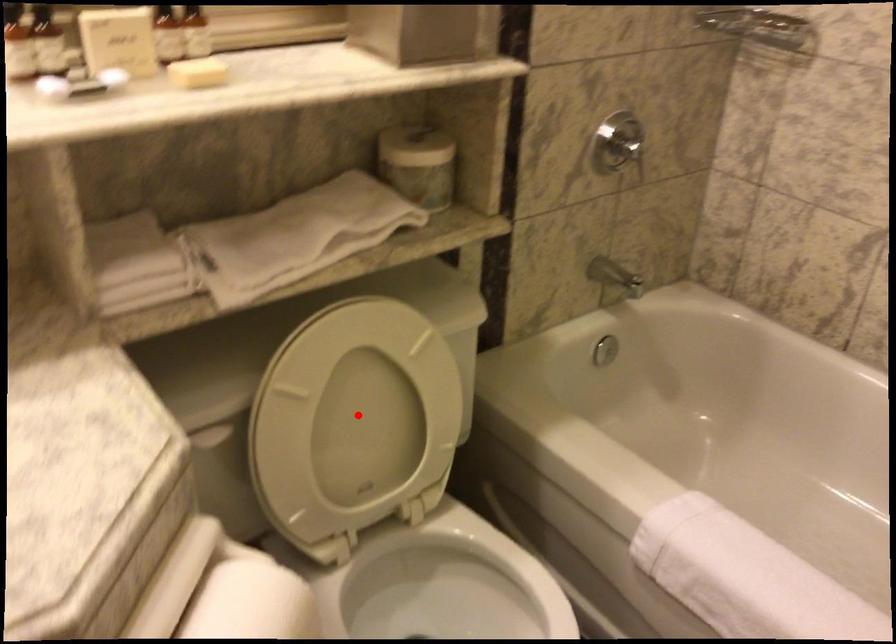
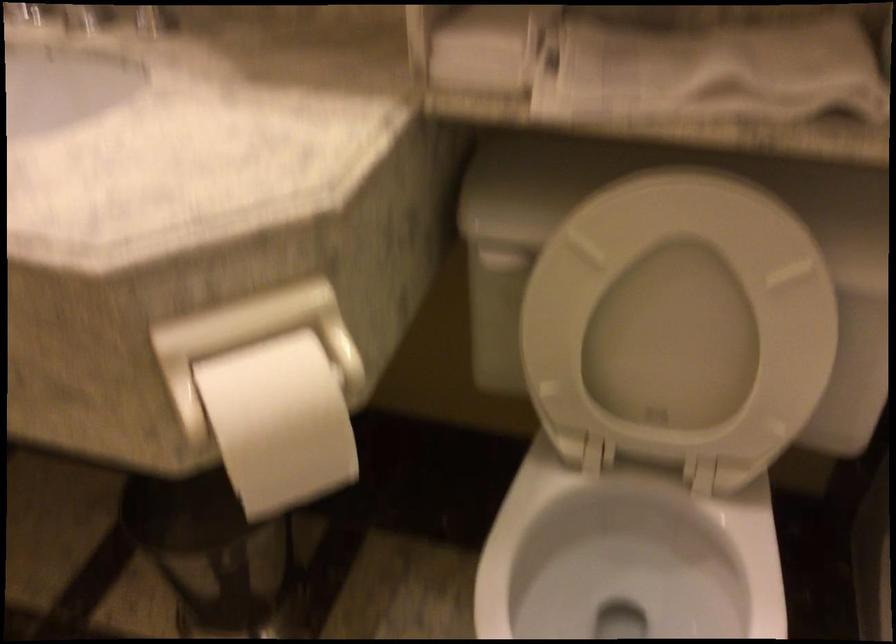
Question: A red point is marked in image1. In image2, is the corresponding 3D point closer to the camera or farther? Reply with the corresponding letter.

Choices:
 (A) The corresponding 3D point is closer.
 (B) The corresponding 3D point is farther.

Answer: (A)